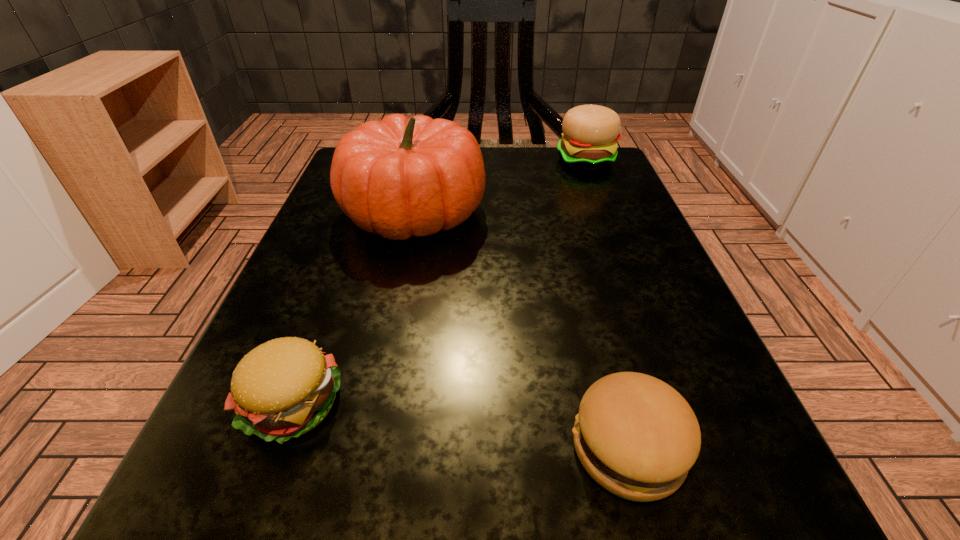
Where is `pumpkin`? pumpkin is located at coordinates coord(399,177).

You are a GUI agent. You are given a task and a screenshot of the screen. Output one action in this format:
    pyautogui.click(x=<x>, y=<y>)
    Task: Click on the tallest object
    Image resolution: width=960 pixels, height=540 pixels.
    Given the screenshot: What is the action you would take?
    pyautogui.click(x=399, y=177)

What are the coordinates of `the farthest hamburger` in the screenshot? It's located at (590, 133).

Image resolution: width=960 pixels, height=540 pixels. Find the location of `the farthest object`. the farthest object is located at coordinates (590, 133).

The width and height of the screenshot is (960, 540). What are the coordinates of `the leftmost hamburger` in the screenshot? It's located at (283, 388).

At what (x,y) coordinates should I click in order to perform the action: click on blank space located on the front of the pumpkin. Please return your answer as a coordinate pair (x, y). Looking at the image, I should click on (348, 523).

This screenshot has width=960, height=540. In order to click on vacant space located on the front of the farthest hamburger in this screenshot , I will do `click(610, 220)`.

Identify the location of vacant space situated 0.120m on the right of the leftmost hamburger. The image size is (960, 540). coord(448,404).

Identify the location of pumpkin that is at the far edge. (399, 177).

This screenshot has width=960, height=540. Find the location of `hamburger situated at the far edge`. hamburger situated at the far edge is located at coordinates (590, 133).